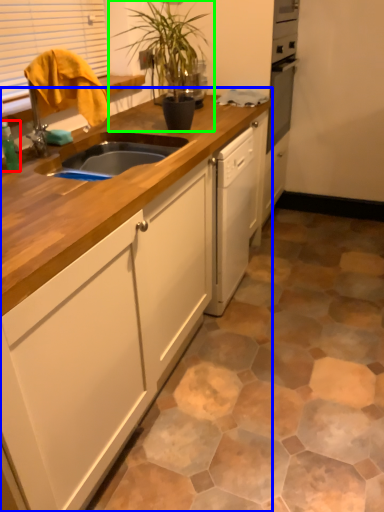
Question: Estimate the real-world distances between objects in this image. Which object is closer to bottle (highlighted by a red box), cabinetry (highlighted by a blue box) or houseplant (highlighted by a green box)?

Choices:
 (A) cabinetry
 (B) houseplant

Answer: (A)